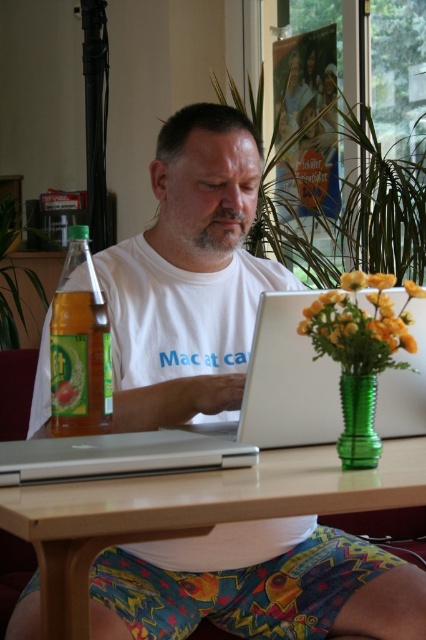
Does white plastic laptop at center have a smaller size compared to translucent yellow bottle at left?

Actually, white plastic laptop at center might be larger than translucent yellow bottle at left.

Does white plastic laptop at center appear over translucent yellow bottle at left?

Actually, white plastic laptop at center is below translucent yellow bottle at left.

Between point (287, 376) and point (71, 420), which one is positioned in front?

Point (71, 420) is more forward.

The height and width of the screenshot is (640, 426). I want to click on white plastic laptop at center, so click(287, 380).

Based on the photo, between white plastic laptop at center and green glass vase at lower right, which one has more height?

white plastic laptop at center

Does white plastic laptop at center lie behind green glass vase at lower right?

That is True.

Image resolution: width=426 pixels, height=640 pixels. I want to click on white plastic laptop at center, so click(x=287, y=380).

In the scene shown: Is yellow matte vase at right bigger than yellow matte vase at upper right?

Indeed, yellow matte vase at right has a larger size compared to yellow matte vase at upper right.

Between point (371, 316) and point (353, 289), which one is positioned behind?

The point (371, 316) is more distant.

Where is `yellow matte vase at right`? Image resolution: width=426 pixels, height=640 pixels. yellow matte vase at right is located at coordinates tap(359, 324).